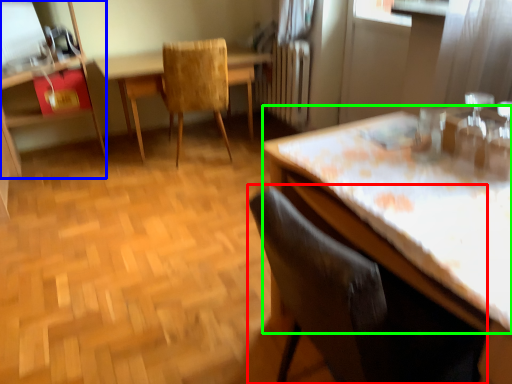
Question: Estimate the real-world distances between objects in this image. Which object is closer to chair (highlighted by a red box), dresser (highlighted by a blue box) or counter top (highlighted by a green box)?

Choices:
 (A) dresser
 (B) counter top

Answer: (B)